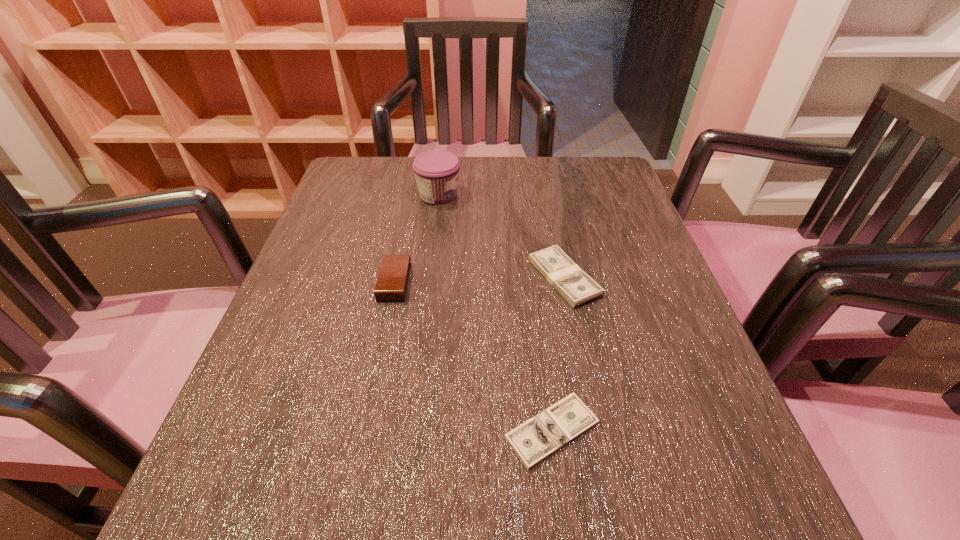
Locate an element on the screen. the tallest object is located at coordinates (437, 172).

Locate an element on the screen. Image resolution: width=960 pixels, height=540 pixels. jam is located at coordinates (437, 172).

At what (x,y) coordinates should I click in order to perform the action: click on the second tallest object. Please return your answer as a coordinate pair (x, y). The width and height of the screenshot is (960, 540). Looking at the image, I should click on (392, 282).

Locate an element on the screen. the farther dollar is located at coordinates (574, 285).

Find the location of a particular element. the taller dollar is located at coordinates (574, 285).

Find the location of a particular element. the shorter dollar is located at coordinates (541, 436).

You are a GUI agent. You are given a task and a screenshot of the screen. Output one action in this format:
    pyautogui.click(x=<x>, y=<y>)
    Task: Click on the shortest object
    This screenshot has width=960, height=540.
    Given the screenshot: What is the action you would take?
    pyautogui.click(x=541, y=436)

Identify the location of vacant space situated 0.380m on the front label of the farthest object. This screenshot has height=540, width=960. (615, 194).

Where is `vacant space located on the front face of the alarm clock`? vacant space located on the front face of the alarm clock is located at coordinates (566, 282).

Identify the location of blank space located 0.360m on the back of the farther dollar. Image resolution: width=960 pixels, height=540 pixels. (541, 166).